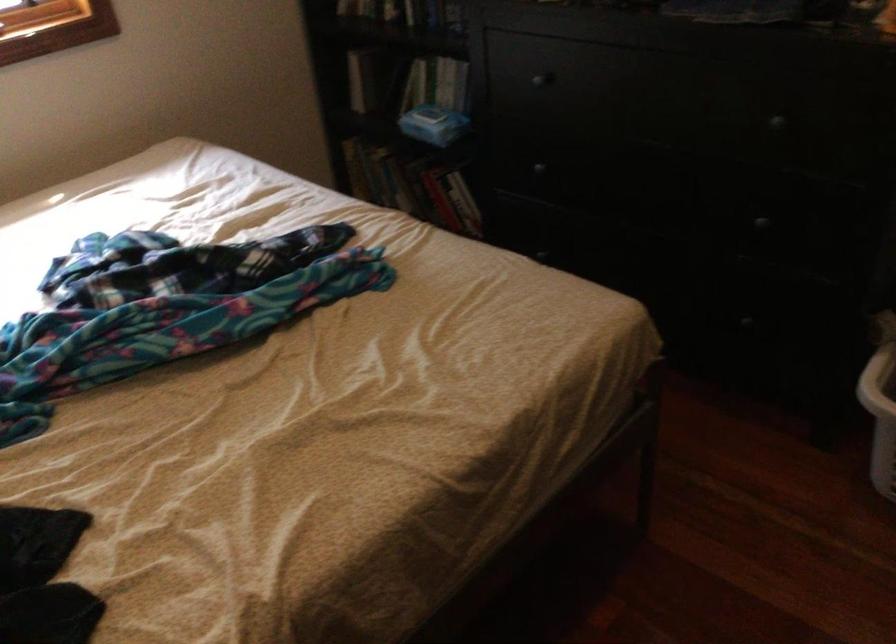
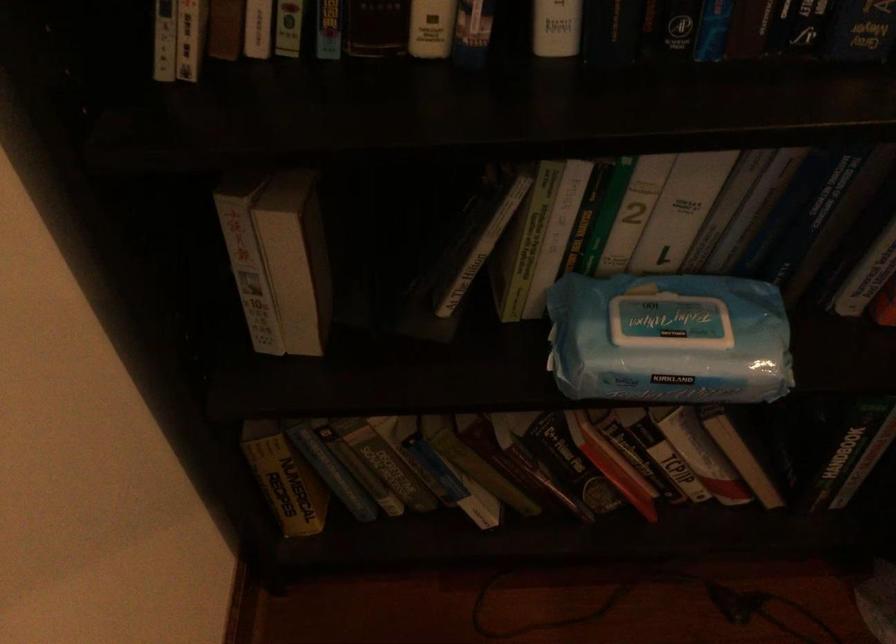
Find the pixel in the second image that matches point (414, 84) in the first image.

(522, 243)